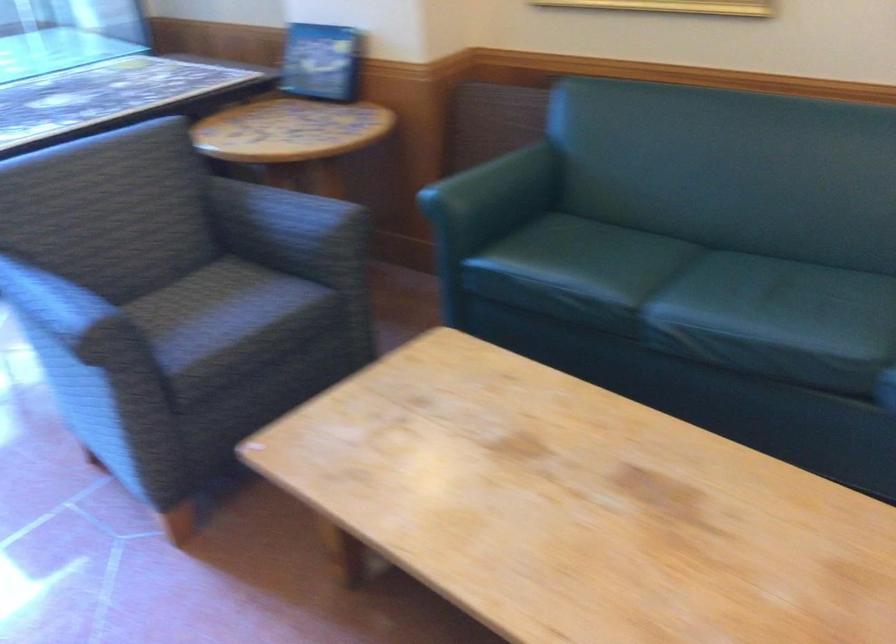
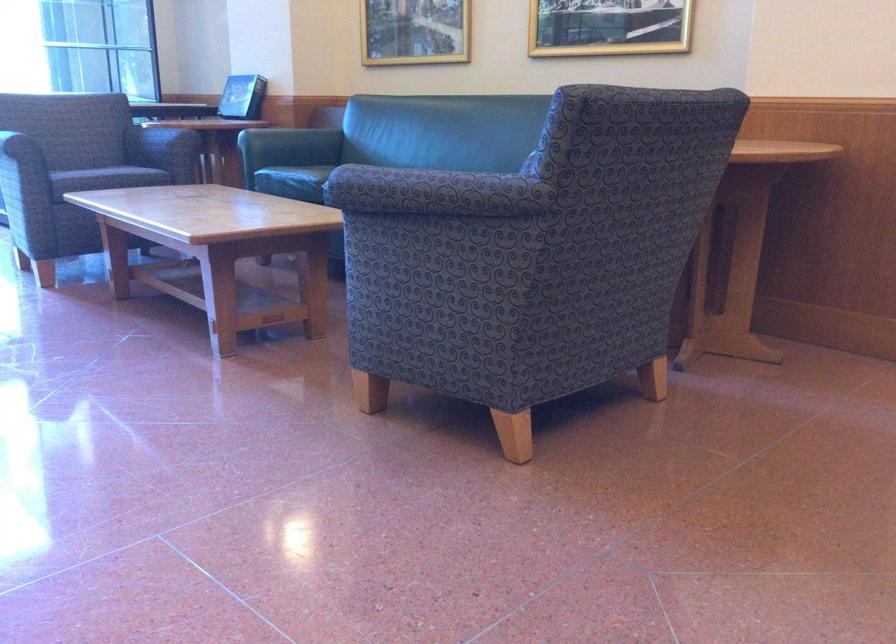
Question: I am providing you with two images of the same scene from different viewpoints. Please identify which objects are invisible in image2.

Choices:
 (A) sofa sitting surface
 (B) sofa armrest
 (C) patterned chair armrest
 (D) light blue thermos

Answer: (A)